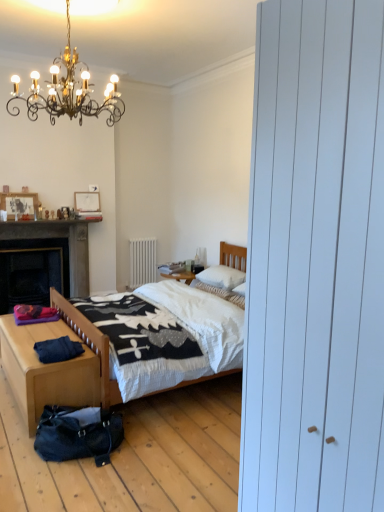
Question: Should I look upward or downward to see wooden table at lower left?

Choices:
 (A) up
 (B) down

Answer: (B)

Question: Does leather textured bag at lower left have a larger size compared to white soft pillow at center, the first pillow ordered from the bottom?

Choices:
 (A) no
 (B) yes

Answer: (B)

Question: From the image's perspective, does leather textured bag at lower left appear higher than white soft pillow at center, the first pillow ordered from the bottom?

Choices:
 (A) no
 (B) yes

Answer: (A)

Question: Is leather textured bag at lower left wider than white soft pillow at center, the first pillow ordered from the bottom?

Choices:
 (A) yes
 (B) no

Answer: (A)

Question: Is leather textured bag at lower left next to white soft pillow at center, which is counted as the 2th pillow, starting from the top?

Choices:
 (A) yes
 (B) no

Answer: (B)

Question: Is leather textured bag at lower left smaller than white soft pillow at center, which is counted as the 2th pillow, starting from the top?

Choices:
 (A) no
 (B) yes

Answer: (A)

Question: Can you confirm if leather textured bag at lower left is shorter than white soft pillow at center, which is counted as the 2th pillow, starting from the top?

Choices:
 (A) yes
 (B) no

Answer: (B)

Question: Considering the relative sizes of gold wrought iron chandelier at upper left and matte white fireplace at upper left in the image provided, is gold wrought iron chandelier at upper left taller than matte white fireplace at upper left?

Choices:
 (A) yes
 (B) no

Answer: (A)

Question: Would you say gold wrought iron chandelier at upper left is outside matte white fireplace at upper left?

Choices:
 (A) yes
 (B) no

Answer: (A)

Question: Could you tell me if gold wrought iron chandelier at upper left is facing matte white fireplace at upper left?

Choices:
 (A) no
 (B) yes

Answer: (A)

Question: Is gold wrought iron chandelier at upper left closer to the viewer compared to matte white fireplace at upper left?

Choices:
 (A) no
 (B) yes

Answer: (B)

Question: Does gold wrought iron chandelier at upper left have a lesser height compared to matte white fireplace at upper left?

Choices:
 (A) no
 (B) yes

Answer: (A)

Question: Does gold wrought iron chandelier at upper left touch matte white fireplace at upper left?

Choices:
 (A) yes
 (B) no

Answer: (B)

Question: Considering the relative sizes of wooden picture frame at upper left, which is the second picture frame in back-to-front order, and white matte radiator at center in the image provided, is wooden picture frame at upper left, which is the second picture frame in back-to-front order, thinner than white matte radiator at center?

Choices:
 (A) yes
 (B) no

Answer: (B)